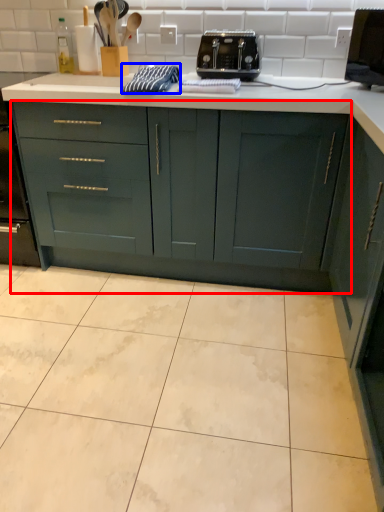
Question: Which object is closer to the camera taking this photo, cabinetry (highlighted by a red box) or material (highlighted by a blue box)?

Choices:
 (A) cabinetry
 (B) material

Answer: (A)